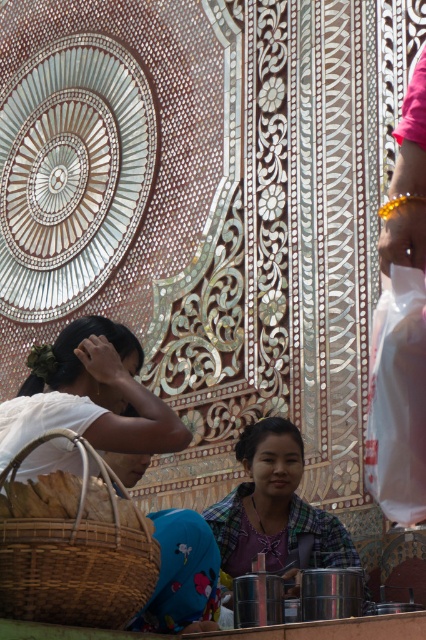
You are a tailor observing the plaid fabric shirt at center and the woven bamboo basket at lower left. Which object is shorter?

The plaid fabric shirt at center is shorter than the woven bamboo basket at lower left.

You are a customer at the market and want to know if the brown woven basket at lower left can fit inside the white matte hair at upper left. Can it fit?

The brown woven basket at lower left is thinner than the white matte hair at upper left, so it cannot fit inside since the basket is thinner but the hair is narrower in width.

Based on the scene description, which object, the white matte hair at upper left or the plaid fabric shirt at center, has a greater width?

The white matte hair at upper left might be wider than plaid fabric shirt at center according to the description.